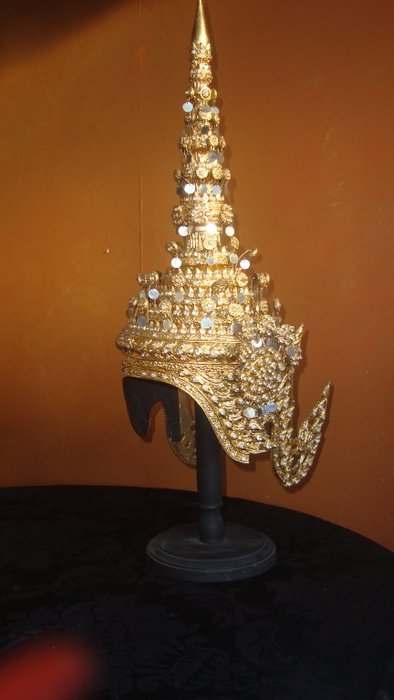
The image size is (394, 700). In order to click on hat holder in this screenshot , I will do `click(214, 549)`.